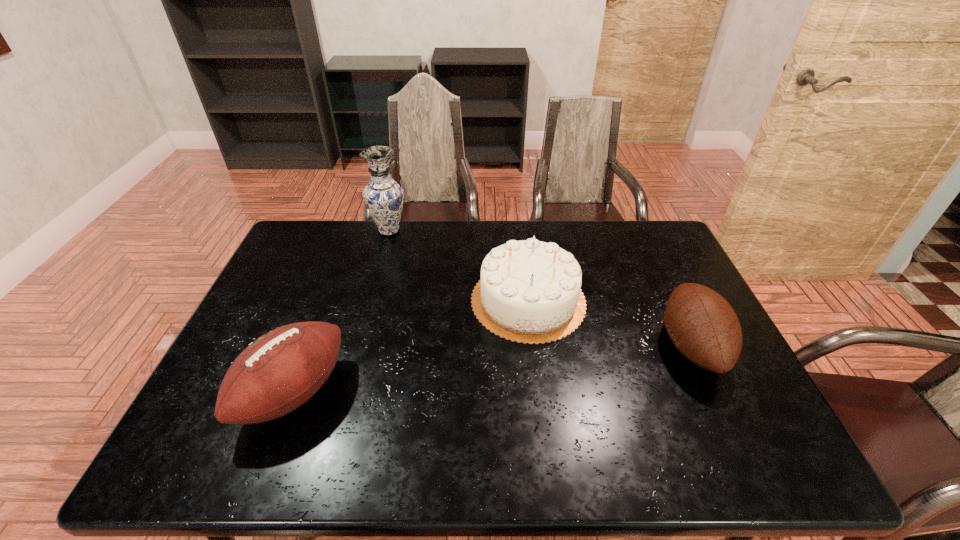
Locate an element on the screen. The image size is (960, 540). the closest object to the vase is located at coordinates (530, 291).

This screenshot has width=960, height=540. Find the location of `vacant area that satisfies the following two spatial constraints: 1. on the back side of the tallest object; 2. on the left side of the left football`. vacant area that satisfies the following two spatial constraints: 1. on the back side of the tallest object; 2. on the left side of the left football is located at coordinates (354, 231).